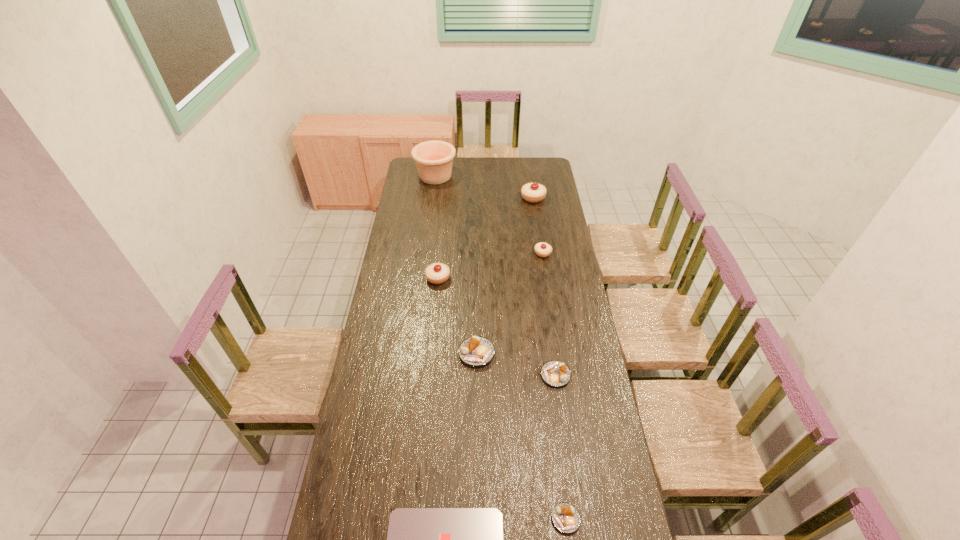
The image size is (960, 540). I want to click on the second smallest brown pastry, so click(555, 373).

This screenshot has width=960, height=540. I want to click on the sixth tallest object, so click(555, 373).

Image resolution: width=960 pixels, height=540 pixels. I want to click on the nearest pastry, so click(566, 518).

Locate an element on the screen. Image resolution: width=960 pixels, height=540 pixels. the shortest pastry is located at coordinates (566, 518).

This screenshot has height=540, width=960. Identify the location of free space located on the front of the farthest object. (430, 217).

I want to click on vacant space located 0.270m on the left of the seventh shortest object, so click(x=474, y=198).

Find the location of a particular element. This screenshot has width=960, height=540. free space located 0.100m on the back of the second tallest pastry is located at coordinates (441, 255).

Find the location of a particular element. Image resolution: width=960 pixels, height=540 pixels. free location located on the front of the sixth nearest object is located at coordinates (550, 301).

At what (x,y) coordinates should I click in order to perform the action: click on vacant space located on the left of the second pastry from left to right. Please return your answer as a coordinate pair (x, y). The width and height of the screenshot is (960, 540). Looking at the image, I should click on (412, 353).

The width and height of the screenshot is (960, 540). I want to click on vacant region located on the front of the third shortest object, so click(x=564, y=439).